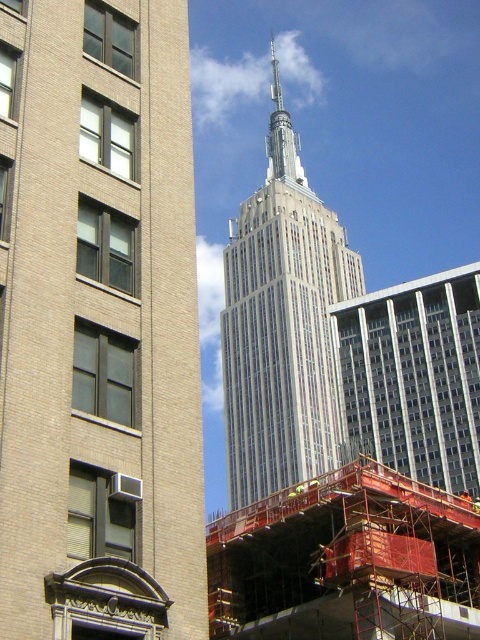
What are the coordinates of the white glass skyscraper at center?

The coordinates of the white glass skyscraper at center are point [98,324].

You are an architect evaluating the cityscape. You notice two structures at the center of the image. Which one is taller between the white glass skyscraper at center and the white glass tower at center?

The white glass tower at center is taller than the white glass skyscraper at center.